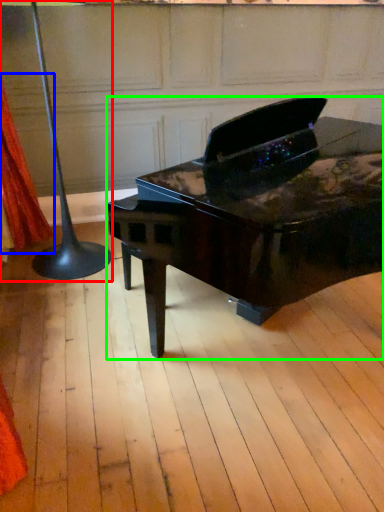
Question: Which is nearer to the table lamp (highlighted by a red box)? curtain (highlighted by a blue box) or piano (highlighted by a green box).

Choices:
 (A) curtain
 (B) piano

Answer: (A)